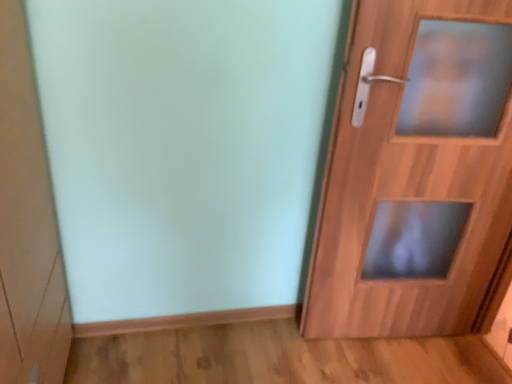
Identify the location of vacant space behind matte white cabinet at left. This screenshot has height=384, width=512. (101, 348).